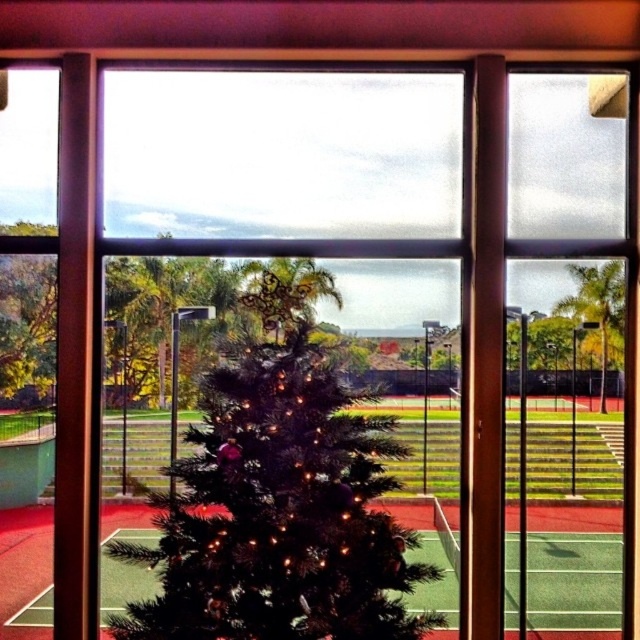
Is green matte christmas tree at center taller than green artificial turf at center?

Indeed, green matte christmas tree at center has a greater height compared to green artificial turf at center.

Does green matte christmas tree at center have a lesser width compared to green artificial turf at center?

In fact, green matte christmas tree at center might be wider than green artificial turf at center.

Is point (355, 499) closer to camera compared to point (548, 509)?

Yes, point (355, 499) is in front of point (548, 509).

Where is `green matte christmas tree at center`? Image resolution: width=640 pixels, height=640 pixels. green matte christmas tree at center is located at coordinates (280, 500).

Is green artificial turf at center thinner than green matte tree at left?

In fact, green artificial turf at center might be wider than green matte tree at left.

Which is above, green artificial turf at center or green matte tree at left?

green matte tree at left

Describe the element at coordinates (24, 564) in the screenshot. I see `green artificial turf at center` at that location.

Locate an element on the screen. The image size is (640, 640). green artificial turf at center is located at coordinates (24, 564).

What do you see at coordinates (280, 500) in the screenshot? I see `green matte christmas tree at center` at bounding box center [280, 500].

Does green matte christmas tree at center have a larger size compared to green matte tree at left?

Yes.

Is point (164, 620) positioned behind point (45, 380)?

No, (164, 620) is in front of (45, 380).

You are a GUI agent. You are given a task and a screenshot of the screen. Output one action in this format:
    pyautogui.click(x=<x>, y=<y>)
    Task: Click on the green matte christmas tree at center
    This screenshot has width=640, height=640.
    Given the screenshot: What is the action you would take?
    pyautogui.click(x=280, y=500)